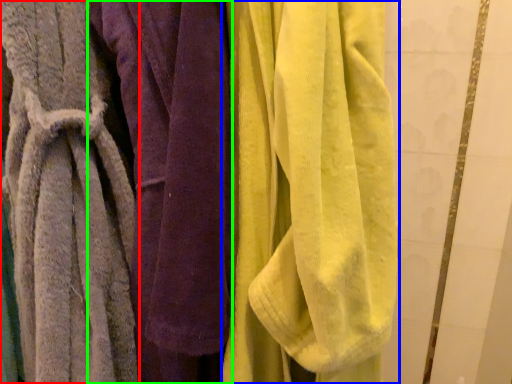
Question: Which object is positioned closest to towel (highlighted by a red box)? Select from towel (highlighted by a blue box) and towel (highlighted by a green box).

Choices:
 (A) towel
 (B) towel

Answer: (B)